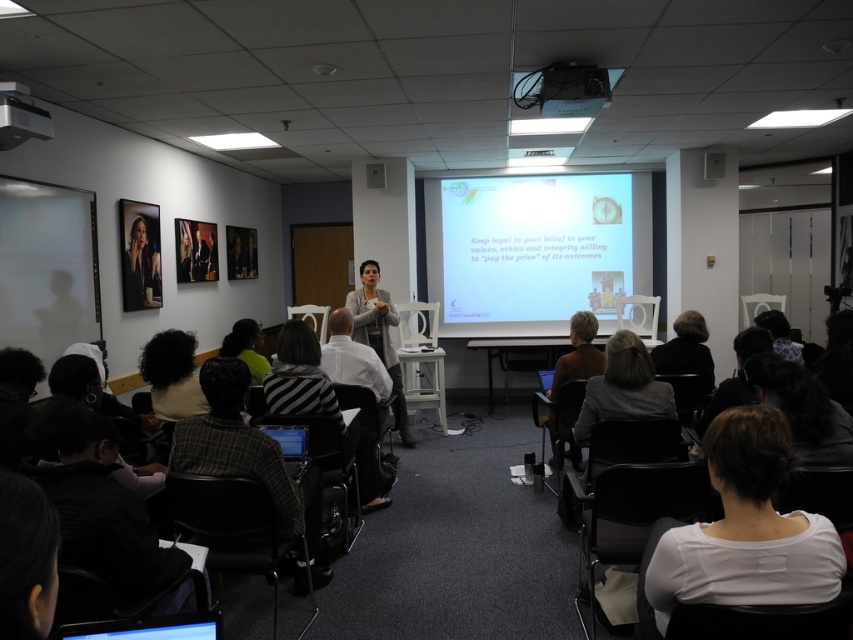
Question: Which is farther from the blue floral-patterned sweater at lower right?

Choices:
 (A) matte black portrait at upper left
 (B) metallic projector at upper center
 (C) striped fabric shirt at center

Answer: (A)

Question: Can you confirm if black fabric headscarf at lower left is thinner than white matte projection screen at upper center?

Choices:
 (A) yes
 (B) no

Answer: (A)

Question: Which point is farther to the camera?

Choices:
 (A) matte black portrait at upper left
 (B) white matte projection screen at upper center
 (C) striped fabric shirt at center
 (D) blue floral-patterned sweater at lower right

Answer: (B)

Question: Does white matte shirt at lower right appear under plaid fabric jacket at lower left?

Choices:
 (A) no
 (B) yes

Answer: (A)

Question: Is metallic projector at upper center wider than blue floral-patterned sweater at lower right?

Choices:
 (A) yes
 (B) no

Answer: (B)

Question: Which is nearer to the plaid fabric jacket at lower left?

Choices:
 (A) blue floral-patterned sweater at lower right
 (B) black fabric headscarf at lower left

Answer: (B)